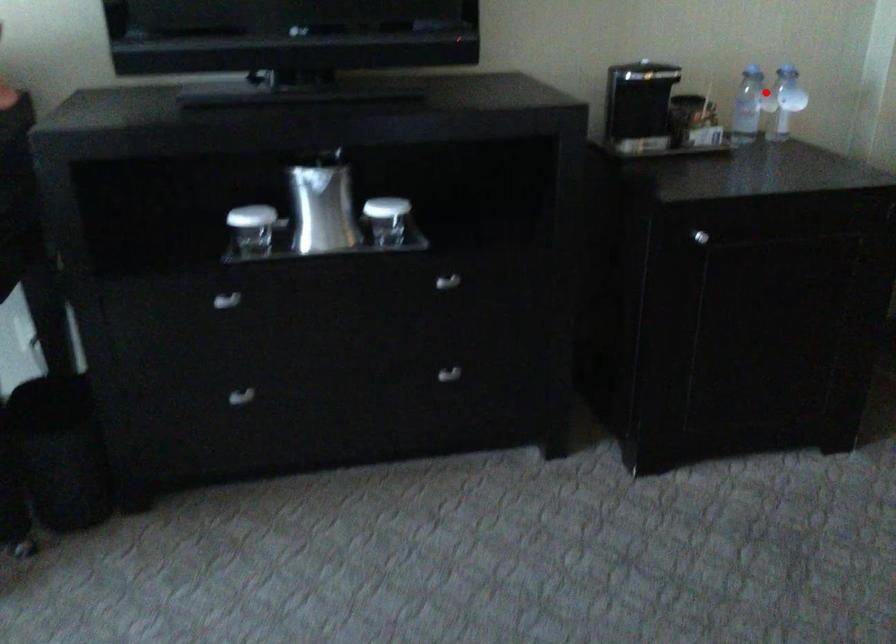
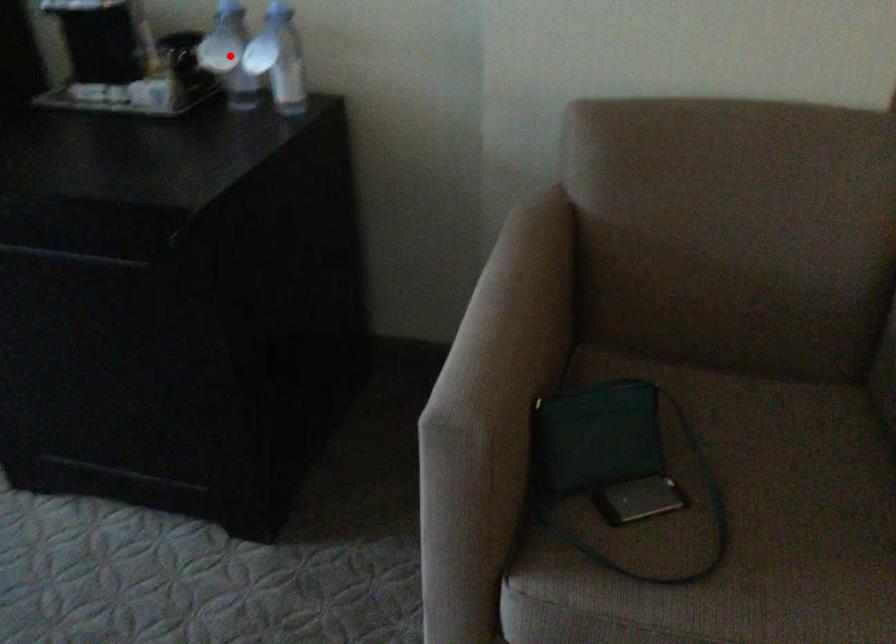
I am providing you with two images of the same scene from different viewpoints. A red point is marked on the first image and another point is marked on the second image. Does the point marked in image1 correspond to the same location as the one in image2?

Yes